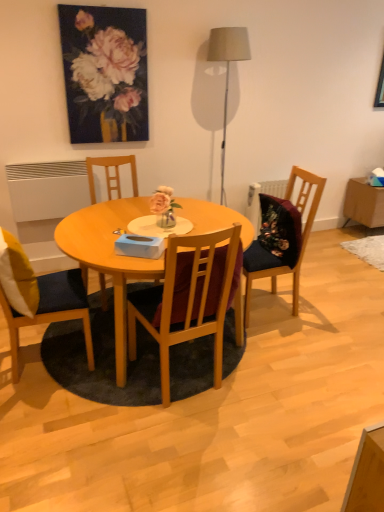
Question: Is oil painting at upper center positioned beyond the bounds of wooden side table at right?

Choices:
 (A) yes
 (B) no

Answer: (A)

Question: Is oil painting at upper center bigger than wooden side table at right?

Choices:
 (A) no
 (B) yes

Answer: (A)

Question: Is oil painting at upper center to the right of wooden side table at right from the viewer's perspective?

Choices:
 (A) yes
 (B) no

Answer: (B)

Question: Is oil painting at upper center looking in the opposite direction of wooden side table at right?

Choices:
 (A) yes
 (B) no

Answer: (B)

Question: Does oil painting at upper center have a lesser height compared to wooden side table at right?

Choices:
 (A) yes
 (B) no

Answer: (B)

Question: Is oil painting at upper center thinner than wooden side table at right?

Choices:
 (A) no
 (B) yes

Answer: (B)

Question: From a real-world perspective, is wooden chair at left, positioned as the 4th chair in right-to-left order, located higher than yellow fabric pillow at left?

Choices:
 (A) yes
 (B) no

Answer: (B)

Question: Does wooden chair at left, the 1th chair positioned from the left, have a lesser width compared to yellow fabric pillow at left?

Choices:
 (A) yes
 (B) no

Answer: (B)

Question: Is the position of wooden chair at left, the 1th chair positioned from the left, more distant than that of yellow fabric pillow at left?

Choices:
 (A) no
 (B) yes

Answer: (A)

Question: Are wooden chair at left, the 1th chair positioned from the left, and yellow fabric pillow at left far apart?

Choices:
 (A) yes
 (B) no

Answer: (B)

Question: Can we say wooden chair at left, the 1th chair positioned from the left, lies outside yellow fabric pillow at left?

Choices:
 (A) yes
 (B) no

Answer: (A)

Question: Could you tell me if wooden chair at left, the 1th chair positioned from the left, is turned towards yellow fabric pillow at left?

Choices:
 (A) no
 (B) yes

Answer: (B)

Question: Is wooden chair at left, the 1th chair positioned from the left, not close to matte gray floor lamp at upper center?

Choices:
 (A) no
 (B) yes

Answer: (B)